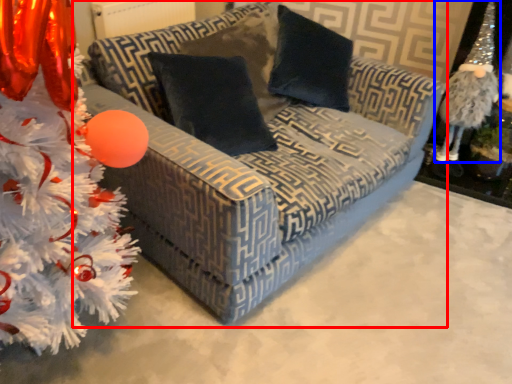
Question: Among these objects, which one is farthest to the camera, studio couch (highlighted by a red box) or toy (highlighted by a blue box)?

Choices:
 (A) studio couch
 (B) toy

Answer: (B)